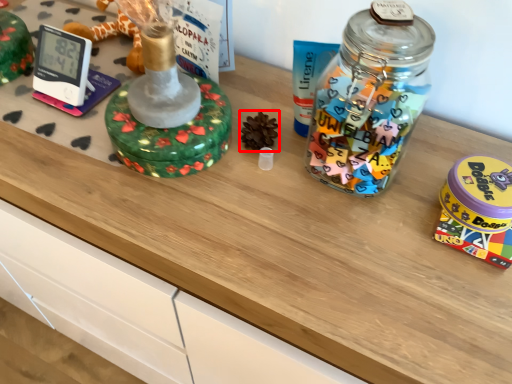
Question: Where is toy (annotated by the red box) located in relation to toy in the image?

Choices:
 (A) left
 (B) right

Answer: (A)